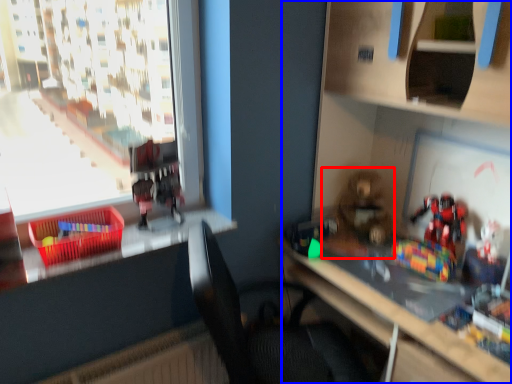
Question: Which of the following is the closest to the observer, toy (highlighted by a red box) or bookshelf (highlighted by a blue box)?

Choices:
 (A) toy
 (B) bookshelf

Answer: (B)